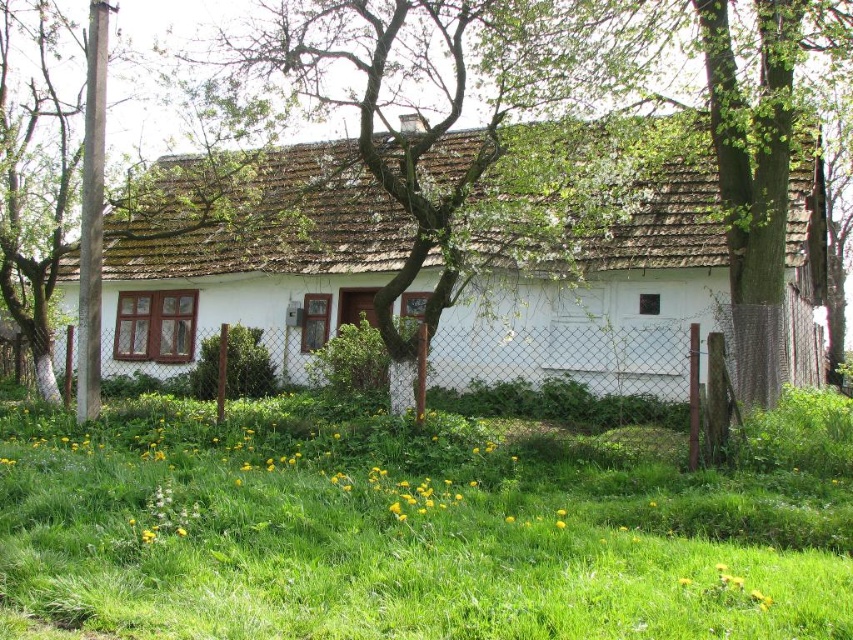
Question: Which object is the farthest from the white wire mesh fence at center?

Choices:
 (A) white matte house at center
 (B) green grass at lower center
 (C) green bark pole at left

Answer: (C)

Question: Is green grass at lower center further to camera compared to white matte house at center?

Choices:
 (A) yes
 (B) no

Answer: (B)

Question: Which of these objects is positioned closest to the green grass at lower center?

Choices:
 (A) green bark pole at left
 (B) white wire mesh fence at center
 (C) white matte house at center

Answer: (B)

Question: Which object is the closest to the green grass at lower center?

Choices:
 (A) green bark pole at left
 (B) white matte house at center

Answer: (B)

Question: Is white matte house at center to the left of white wire mesh fence at center from the viewer's perspective?

Choices:
 (A) yes
 (B) no

Answer: (A)

Question: Can you confirm if green grass at lower center is positioned below white matte house at center?

Choices:
 (A) yes
 (B) no

Answer: (A)